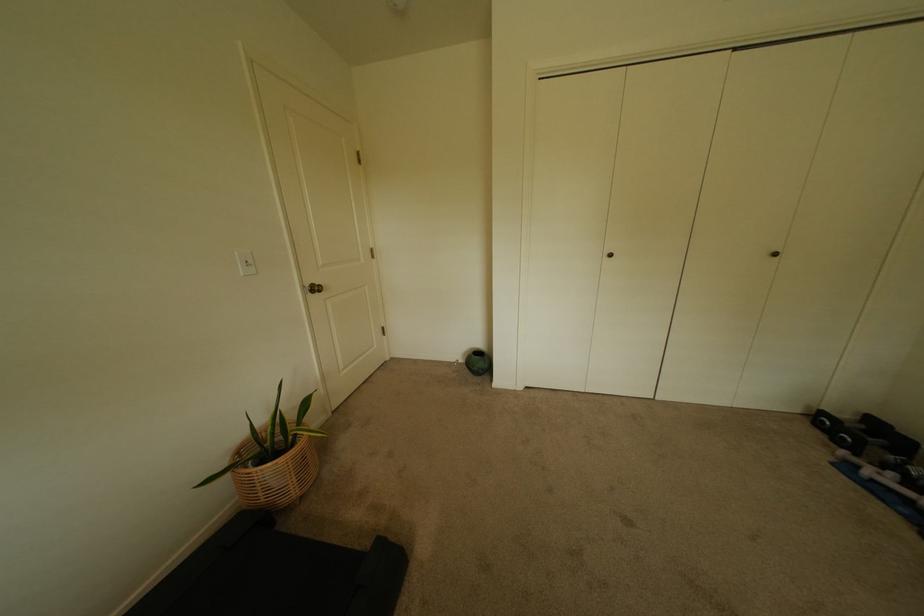
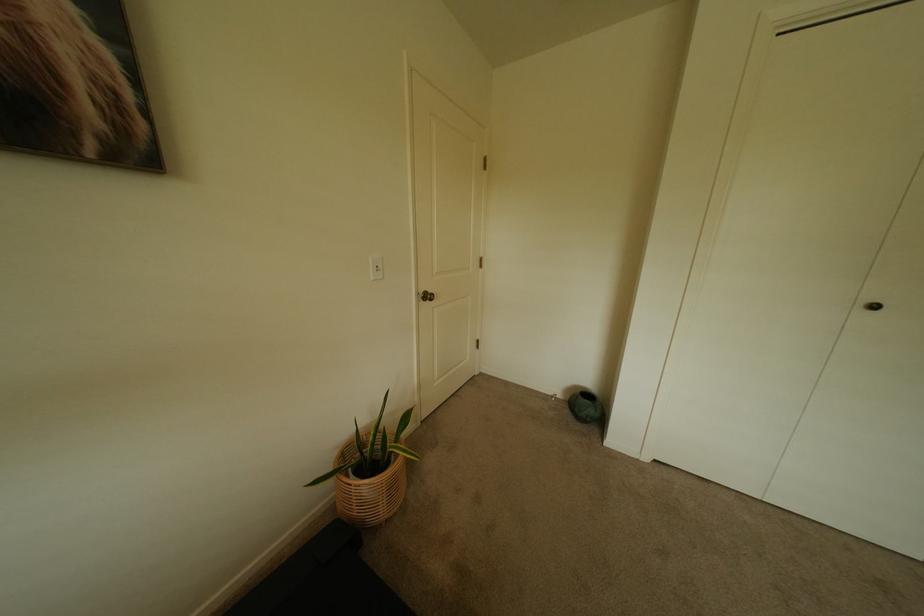
Question: How did the camera likely rotate?

Choices:
 (A) Left
 (B) Right
 (C) Up
 (D) Down

Answer: (A)